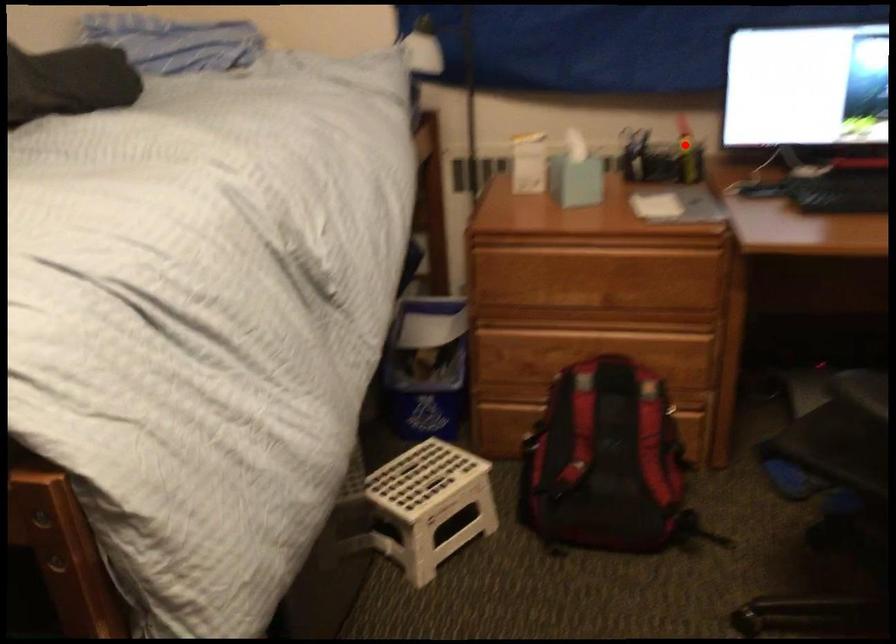
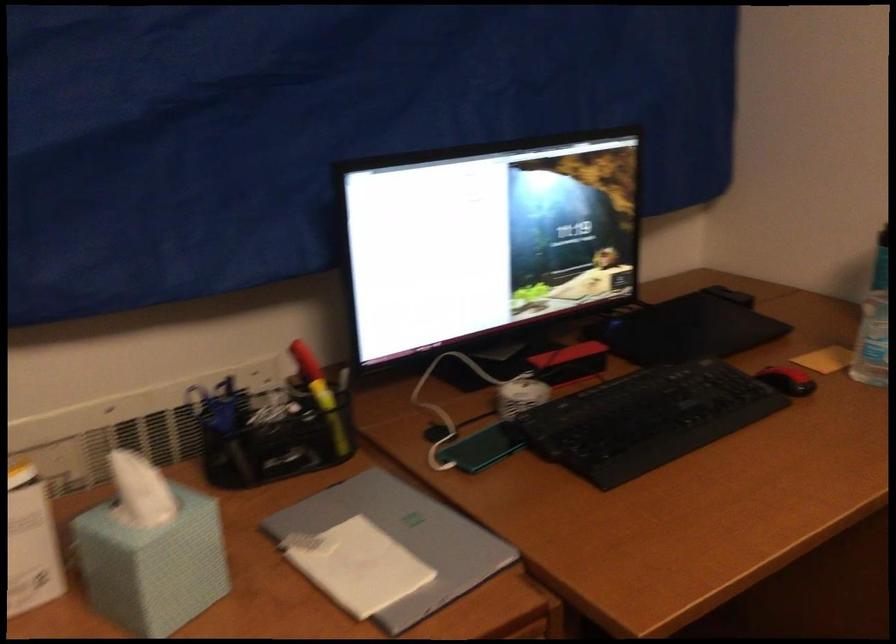
The point at the highlighted location is marked in the first image. Where is the corresponding point in the second image?

(321, 395)